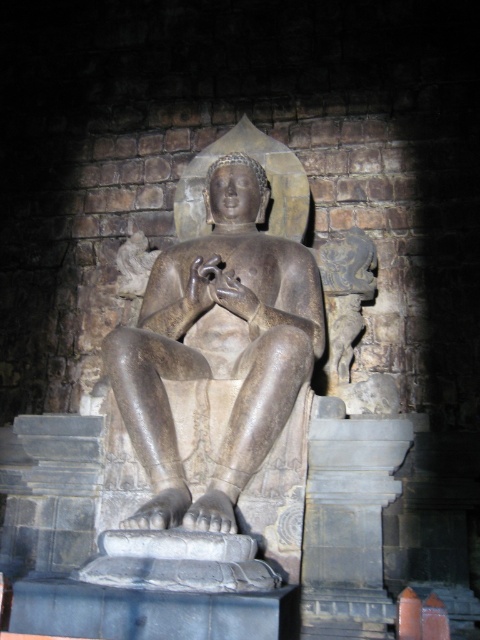
You are a temple visitor standing in front of the polished stone statue at center and the gray stone pedestal at center. Which object is positioned to the left?

The polished stone statue at center is to the left of the gray stone pedestal at center.

You are standing in front of the seated stone statue in the temple. There are two points marked on the statue. One is at coordinates point (244,316) and the other is at point (307,580). Which point is closer to you?

Point (244,316) is further to the viewer than point (307,580), so the point closer to you is point (307,580).